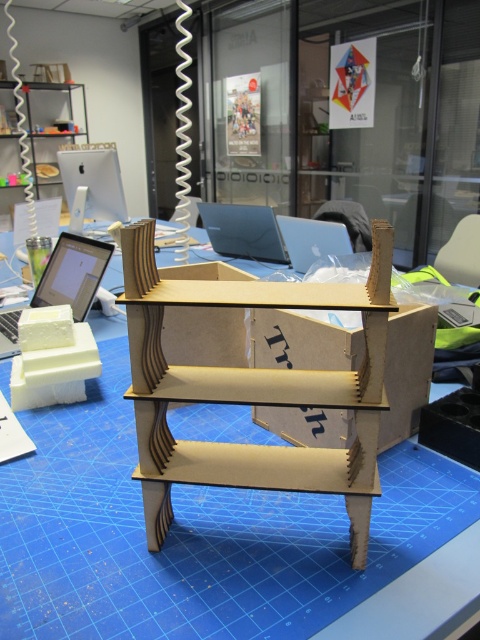
Question: Among these objects, which one is nearest to the camera?

Choices:
 (A) silver metallic laptop at left
 (B) wooden shelf at center

Answer: (B)

Question: Observing the image, what is the correct spatial positioning of wooden shelf at center in reference to satin silver laptop at center?

Choices:
 (A) above
 (B) below

Answer: (B)

Question: Can you confirm if wooden shelf at center is positioned to the right of silver metallic laptop at left?

Choices:
 (A) yes
 (B) no

Answer: (A)

Question: Does wooden shelf at center have a smaller size compared to satin silver laptop at center?

Choices:
 (A) no
 (B) yes

Answer: (A)

Question: Which of the following is the farthest from the observer?

Choices:
 (A) tap(118, 196)
 (B) tap(240, 573)
 (C) tap(3, 356)
 (D) tap(260, 230)

Answer: (A)

Question: Estimate the real-world distances between objects in this image. Which object is closer to the satin silver laptop at center?

Choices:
 (A) wooden shelf at center
 (B) silver metallic laptop at left
 (C) white plastic computer at upper left

Answer: (B)